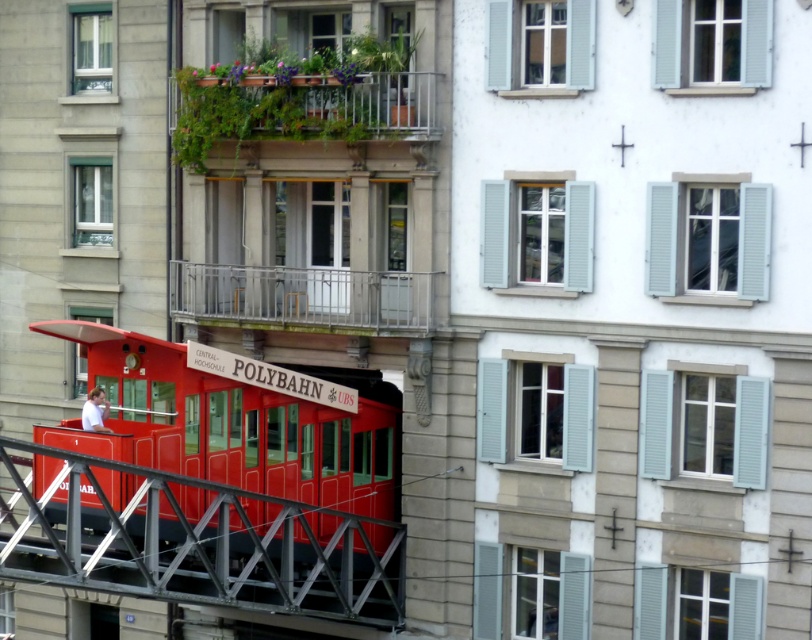
You are a delivery person with a cart that is 4 meters wide. You need to navigate through the narrow passage between the two buildings where the metallic red polybahn car at lower left and the silver metallic railing at center are located. Can your cart fit through the space between them?

The metallic red polybahn car at lower left and the silver metallic railing at center are 4.16 meters apart from each other. Since your cart is 4 meters wide, it can fit through the space between them as the distance is slightly wider than the cart.

You are a delivery person trying to move a large box through the narrow passage between the two buildings. The passage is just wide enough for the metallic red polybahn car at lower left to pass. Can you safely navigate the silver metallic railing at center with your box without hitting it?

The metallic red polybahn car at lower left might be wider than the silver metallic railing at center. Since the passage is only wide enough for the tram, there may not be enough space for your box and the railing. It is safer to avoid this route or find an alternative path to prevent collisions.

You are a tourist standing at the entrance of the passage between the two buildings. You want to take a photo of the metallic red polybahn car at lower left and the silver metallic railing at center. Which object should you focus on first to ensure both are in the frame without moving the camera?

You should focus on the metallic red polybahn car at lower left first because it is larger than the silver metallic railing at center, so centering it will allow the smaller railing to fit into the frame more easily.